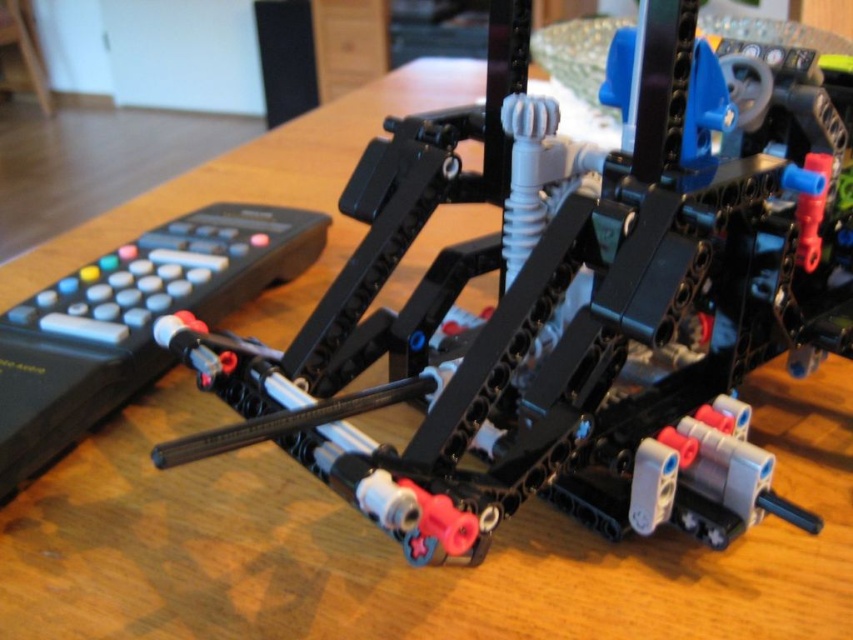
Who is more forward, (393, 320) or (167, 308)?

Point (393, 320) is more forward.

Which is more to the left, black plastic toy at center or black plastic remote at left?

black plastic remote at left

Who is more distant from viewer, (519, 296) or (311, 221)?

Point (311, 221)

This screenshot has width=853, height=640. I want to click on black plastic toy at center, so click(x=572, y=300).